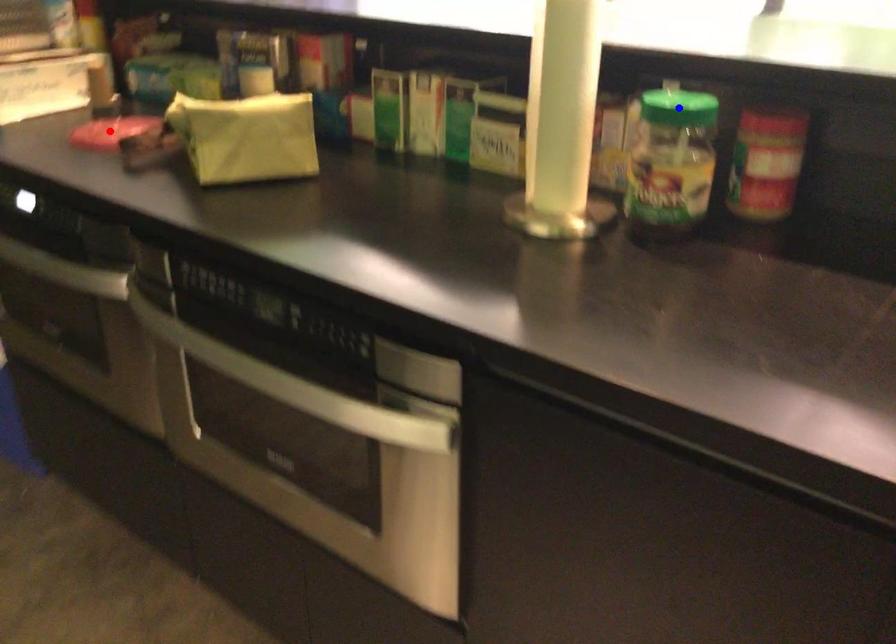
Question: In the image, two points are highlighted. Which point is nearer to the camera? Reply with the corresponding letter.

Choices:
 (A) blue point
 (B) red point

Answer: (A)